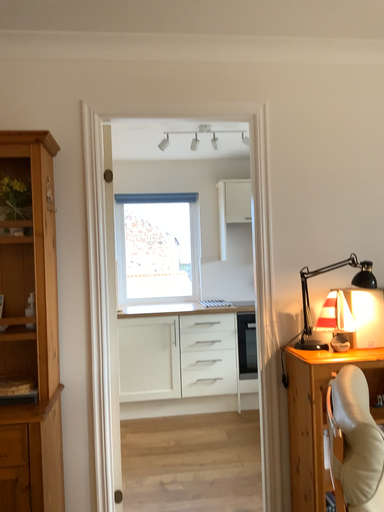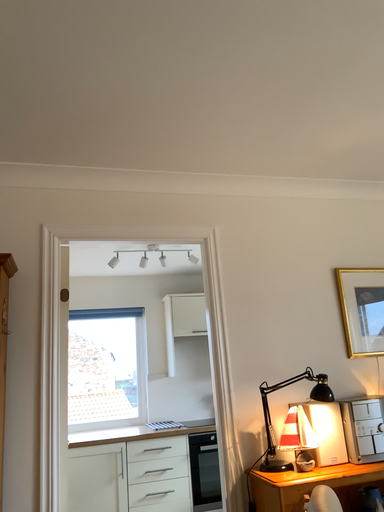
Question: Which way did the camera rotate in the video?

Choices:
 (A) rotated right
 (B) rotated left

Answer: (A)